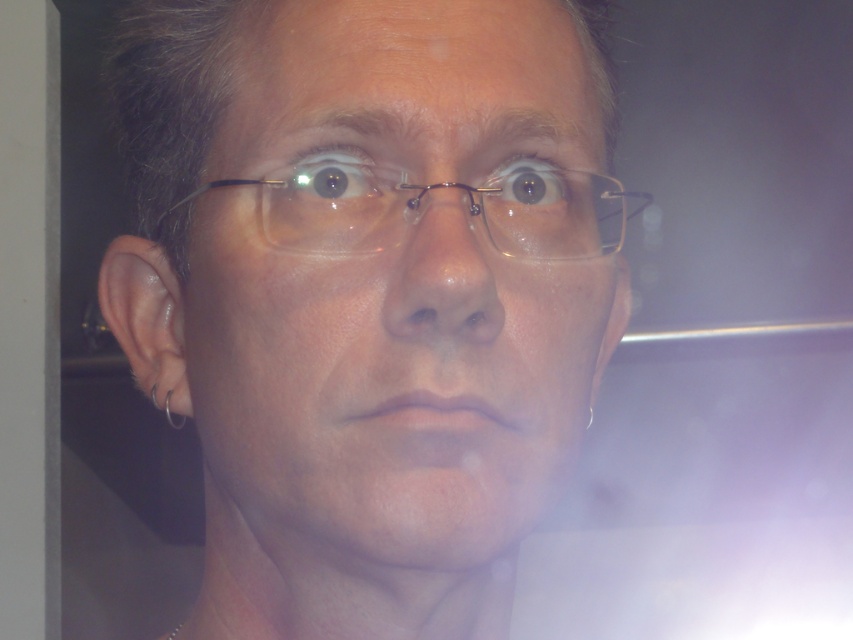
Is point (532, 356) in front of point (326, 161)?

No, it is not.

Is matte glass face at center wider than matte glass eye at upper center?

Correct, the width of matte glass face at center exceeds that of matte glass eye at upper center.

Describe the element at coordinates (387, 384) in the screenshot. Image resolution: width=853 pixels, height=640 pixels. I see `matte glass face at center` at that location.

The width and height of the screenshot is (853, 640). What are the coordinates of `matte glass face at center` in the screenshot? It's located at (387, 384).

Based on the photo, can you confirm if metallic wireframe glasses at center is positioned to the right of silver metallic earring at left?

In fact, metallic wireframe glasses at center is to the left of silver metallic earring at left.

Where is `metallic wireframe glasses at center`? metallic wireframe glasses at center is located at coordinates (427, 204).

Is brown glossy eye at center closer to camera compared to silver metallic hoop earring at left?

Yes, brown glossy eye at center is in front of silver metallic hoop earring at left.

Does point (517, 195) come farther from viewer compared to point (169, 394)?

No, it is in front of (169, 394).

I want to click on brown glossy eye at center, so click(x=527, y=188).